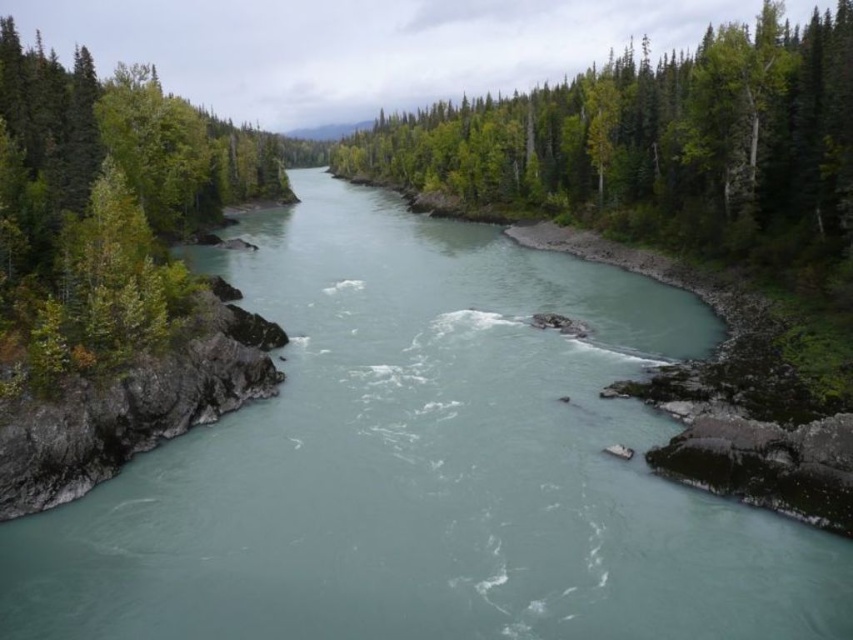
Is green leafy trees at center wider than green leafy tree at left?

Yes, green leafy trees at center is wider than green leafy tree at left.

Between green leafy trees at center and green leafy tree at left, which one is positioned lower?

Positioned lower is green leafy tree at left.

Does point (469, 196) lie behind point (50, 301)?

Yes.

Locate an element on the screen. green leafy trees at center is located at coordinates (659, 145).

Is the position of greenish-blue water at center less distant than that of green leafy trees at center?

Yes, greenish-blue water at center is in front of green leafy trees at center.

Looking at this image, between greenish-blue water at center and green leafy trees at center, which one is positioned lower?

Positioned lower is greenish-blue water at center.

Between point (241, 525) and point (366, 176), which one is positioned behind?

The point (366, 176) is behind.

The image size is (853, 640). In order to click on greenish-blue water at center in this screenshot , I will do `click(422, 465)`.

Measure the distance between point (302, 451) and camera.

Point (302, 451) and camera are 51.82 meters apart from each other.

Is greenish-blue water at center bigger than green leafy tree at left?

No, greenish-blue water at center is not bigger than green leafy tree at left.

Find the location of `greenish-blue water at center`. greenish-blue water at center is located at coordinates (422, 465).

Find the location of a particular element. Image resolution: width=853 pixels, height=640 pixels. greenish-blue water at center is located at coordinates (422, 465).